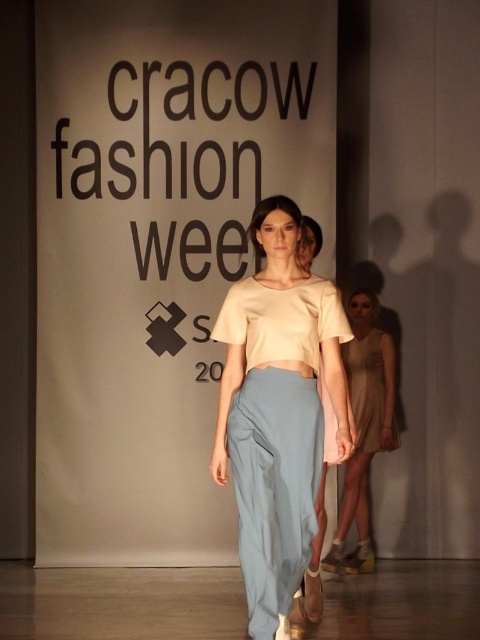
Which is below, matte beige top at center or light beige sheer dress at center?

Positioned lower is light beige sheer dress at center.

Does matte beige top at center have a greater height compared to light beige sheer dress at center?

Yes.

Measure the distance between point (x=311, y=340) and camera.

Point (x=311, y=340) is 3.82 meters away from camera.

Where is `matte beige top at center`? Image resolution: width=480 pixels, height=640 pixels. matte beige top at center is located at coordinates (277, 410).

Is light beige fabric dress at center thinner than light beige sheer dress at center?

Incorrect, light beige fabric dress at center's width is not less than light beige sheer dress at center's.

Can you confirm if light beige fabric dress at center is positioned above light beige sheer dress at center?

No.

This screenshot has height=640, width=480. I want to click on light beige fabric dress at center, so click(364, 426).

Is matte beige top at center further to the viewer compared to light beige fabric dress at center?

That is False.

Does matte beige top at center have a smaller size compared to light beige fabric dress at center?

No.

Measure the distance between matte beige top at center and camera.

They are 11.70 feet apart.

Find the location of a particular element. This screenshot has height=640, width=480. matte beige top at center is located at coordinates pyautogui.click(x=277, y=410).